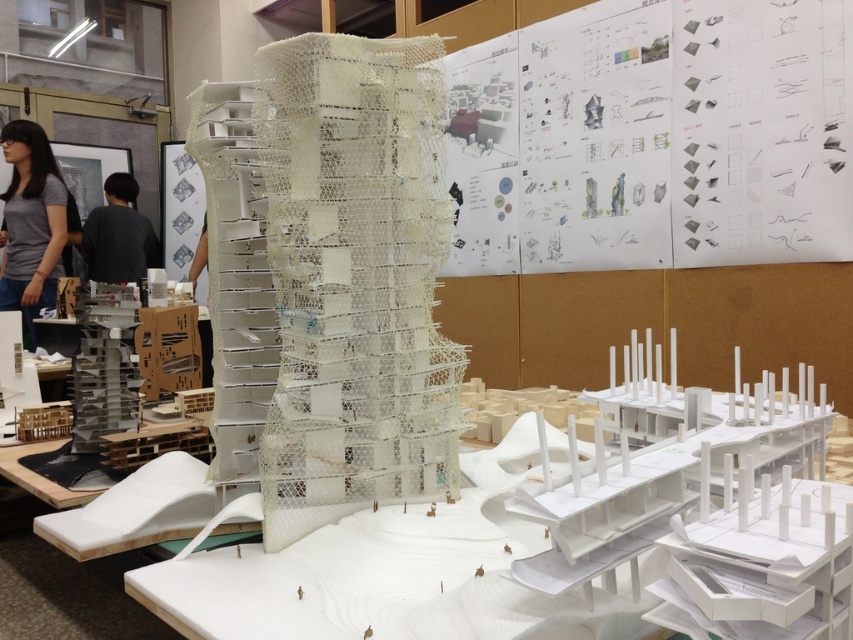
Question: Does gray matte shirt at left appear on the left side of black shirt at left?

Choices:
 (A) yes
 (B) no

Answer: (A)

Question: Among these points, which one is farthest from the camera?

Choices:
 (A) (120, 234)
 (B) (22, 182)

Answer: (A)

Question: Does gray matte shirt at left appear under black shirt at left?

Choices:
 (A) yes
 (B) no

Answer: (A)

Question: Which of the following is the farthest from the observer?

Choices:
 (A) gray matte shirt at left
 (B) black shirt at left

Answer: (B)

Question: Can you confirm if gray matte shirt at left is positioned to the left of black shirt at left?

Choices:
 (A) yes
 (B) no

Answer: (A)